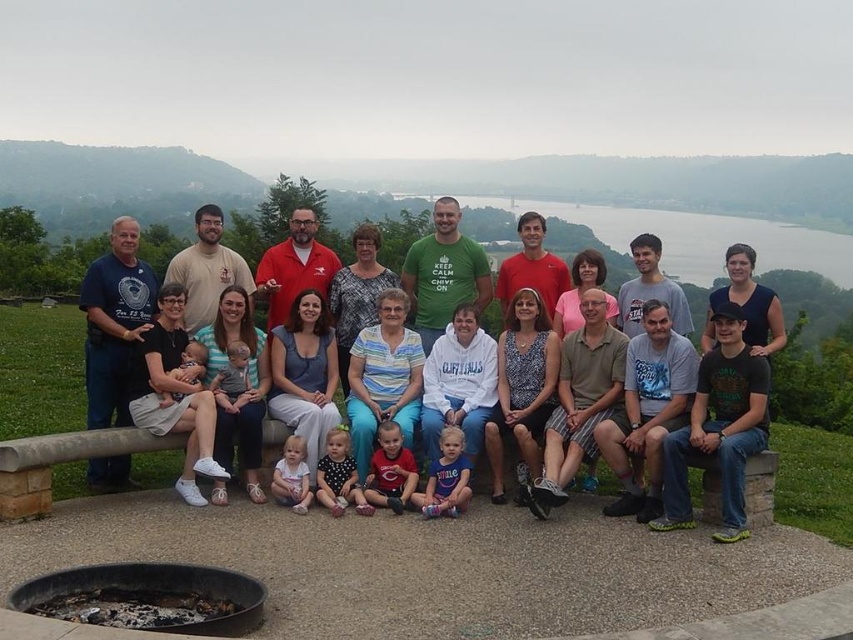
Question: Does green water at upper center appear under soft gray fabric baby at center?

Choices:
 (A) yes
 (B) no

Answer: (B)

Question: Can you confirm if charred metal fire pit at lower left is positioned below soft gray fabric baby at center?

Choices:
 (A) no
 (B) yes

Answer: (B)

Question: Considering the relative positions of matte blue shirt at center and polka dot dress at center in the image provided, where is matte blue shirt at center located with respect to polka dot dress at center?

Choices:
 (A) below
 (B) above

Answer: (A)

Question: Estimate the real-world distances between objects in this image. Which object is farther from the soft gray fabric baby at center?

Choices:
 (A) matte blue jeans at center
 (B) matte blue shirt at center
 (C) red cotton shirt at center

Answer: (B)

Question: Which object is closer to the camera taking this photo?

Choices:
 (A) charred metal fire pit at lower left
 (B) red cotton shirt at center
 (C) matte blue jeans at center
 (D) soft beige fabric baby at center

Answer: (A)

Question: Which object appears farthest from the camera in this image?

Choices:
 (A) polka dot dress at center
 (B) matte blue shirt at center
 (C) soft beige fabric baby at center
 (D) charred metal fire pit at lower left

Answer: (C)